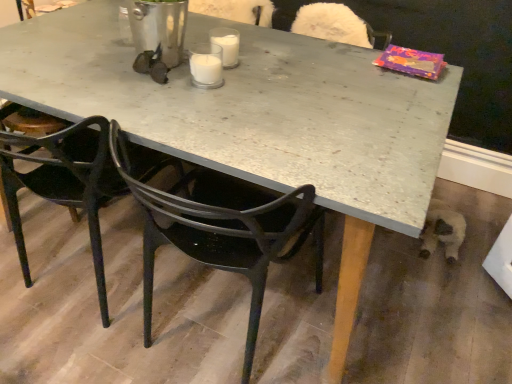
Locate an element on the screen. vacant space in front of white glass candle at center, the second coffee cup positioned from the back is located at coordinates (206, 104).